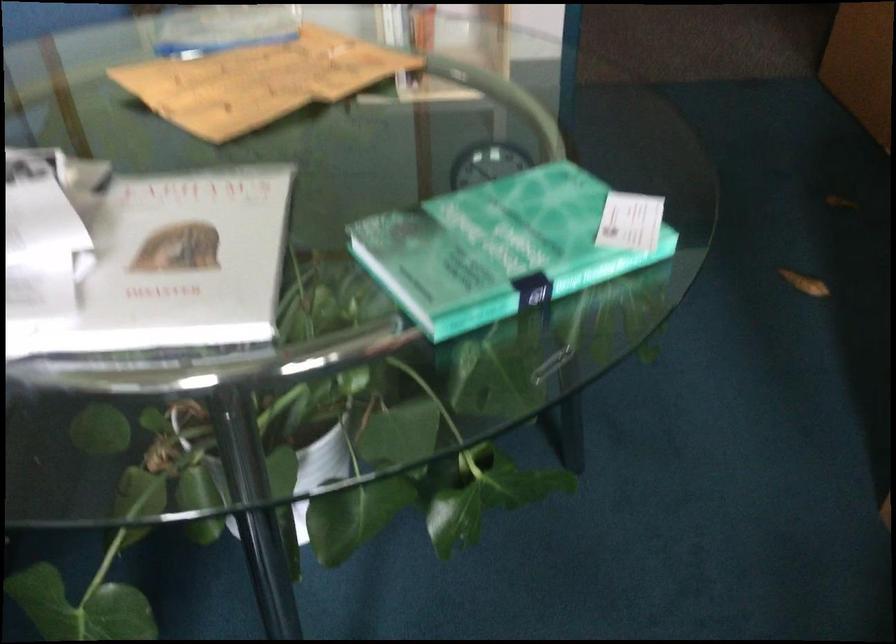
The location [552,365] corresponds to which object?

This point indicates the metal paper clip.